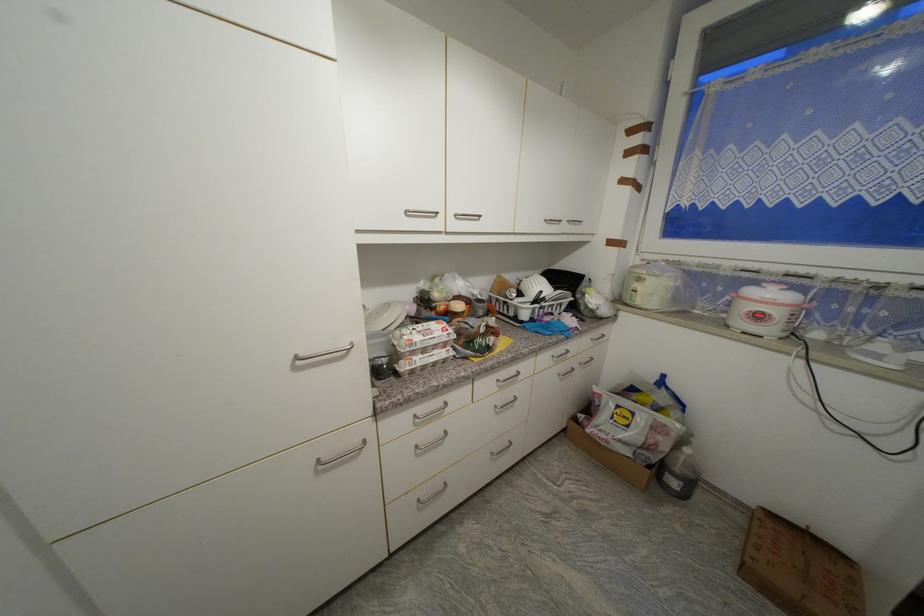
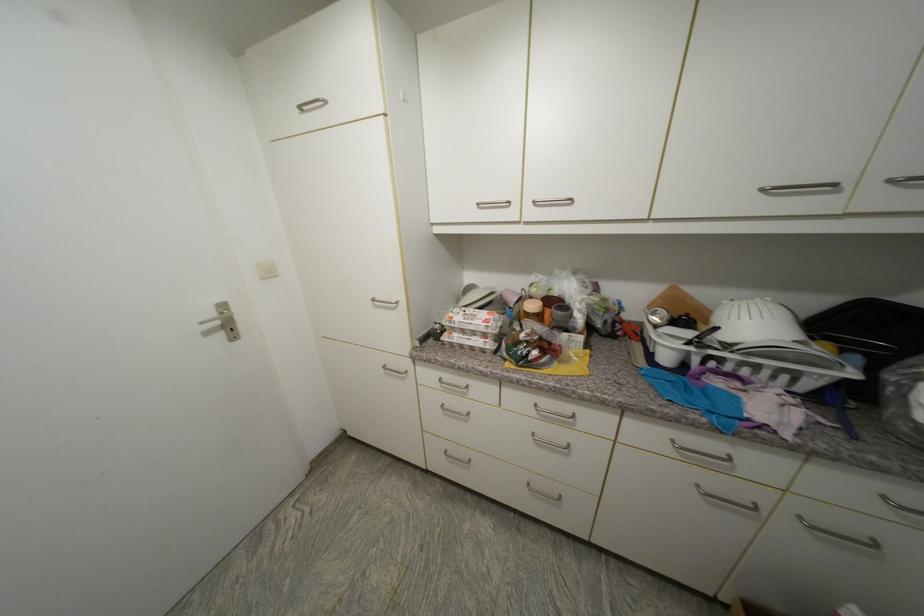
Find the pixel in the second image that matches the point at 546,293 in the first image.

(723, 330)